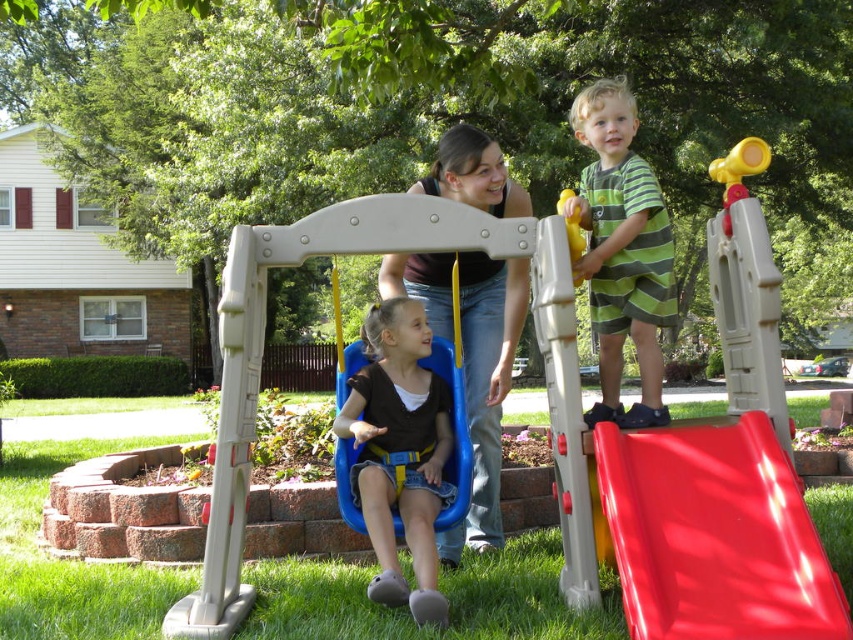
You are a photographer trying to capture a candid shot of the two children in the scene. The green striped shirt at upper right and the yellow plastic handle at upper right are both in your viewfinder. Which object should you focus on if you want to photograph the child who is closer to the camera?

The green striped shirt at upper right has a lesser height compared to the yellow plastic handle at upper right, so focusing on the green striped shirt at upper right would capture the child closer to the camera.

You are a photographer trying to capture a photo of the red plastic slide at right and the brown fabric vest at center. Based on their positions, which object is closer to the camera?

The brown fabric vest at center is closer to the camera because the red plastic slide at right is positioned under it.

You are a photographer trying to capture a closeup shot of the brown fabric vest at center and the yellow plastic handle at upper right. Which object should you zoom in on to ensure both are in focus without moving the camera?

The brown fabric vest at center has a lesser width compared to yellow plastic handle at upper right, so you should zoom in on the brown fabric vest at center to ensure both are in focus without moving the camera.